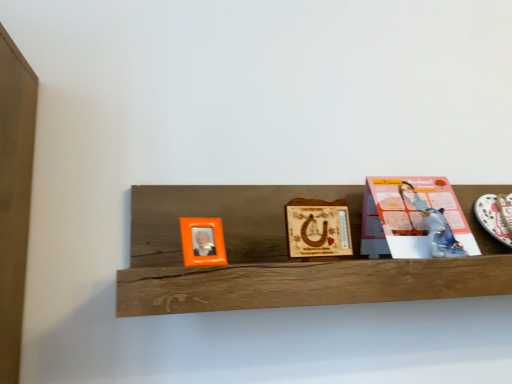
Question: From the image's perspective, is pink paper at right located above or below metallic blue cat at upper right?

Choices:
 (A) above
 (B) below

Answer: (A)

Question: Do you think pink paper at right is within metallic blue cat at upper right, or outside of it?

Choices:
 (A) outside
 (B) inside

Answer: (A)

Question: Which is nearer to the orange plastic picture frame at left, which is the second picture frame from right to left?

Choices:
 (A) metallic blue cat at upper right
 (B) white glossy platter at right
 (C) pink paper at right
 (D) wooden plaque with horseshoe at center, which is the 1th picture frame from right to left
 (E) wooden shelf at center

Answer: (D)

Question: Which object is positioned farthest from the wooden shelf at center?

Choices:
 (A) pink paper at right
 (B) metallic blue cat at upper right
 (C) orange plastic picture frame at left, which appears as the first picture frame when viewed from the left
 (D) white glossy platter at right
 (E) wooden plaque with horseshoe at center, marked as the second picture frame in a left-to-right arrangement

Answer: (D)